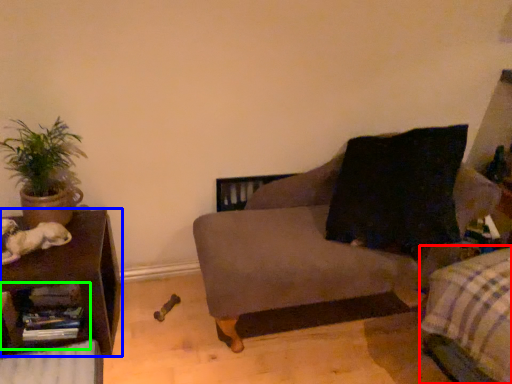
Question: Which is farther away from bedding (highlighted by a red box)? table (highlighted by a blue box) or shelf (highlighted by a green box)?

Choices:
 (A) table
 (B) shelf

Answer: (B)